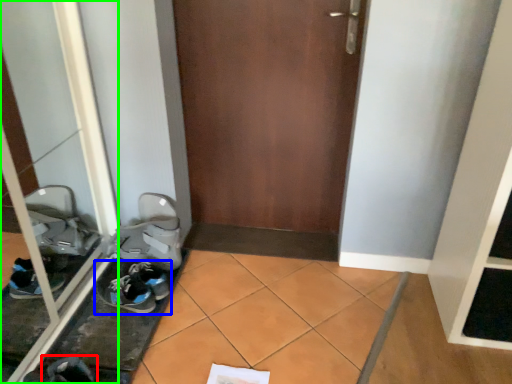
Question: Considering the real-world distances, which object is farthest from footwear (highlighted by a red box)? footwear (highlighted by a blue box) or glass door (highlighted by a green box)?

Choices:
 (A) footwear
 (B) glass door

Answer: (B)